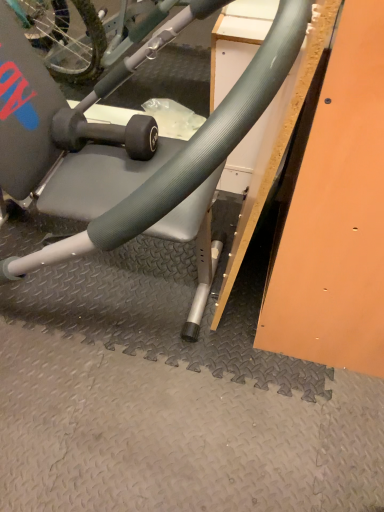
The width and height of the screenshot is (384, 512). Describe the element at coordinates (125, 142) in the screenshot. I see `green rubber bicycle at center` at that location.

Find the location of a particular element. green rubber bicycle at center is located at coordinates (125, 142).

You are a GUI agent. You are given a task and a screenshot of the screen. Output one action in this format:
    pyautogui.click(x=<x>, y=<y>)
    Task: Click on the green rubber bicycle at center
    
    Given the screenshot: What is the action you would take?
    coord(125,142)